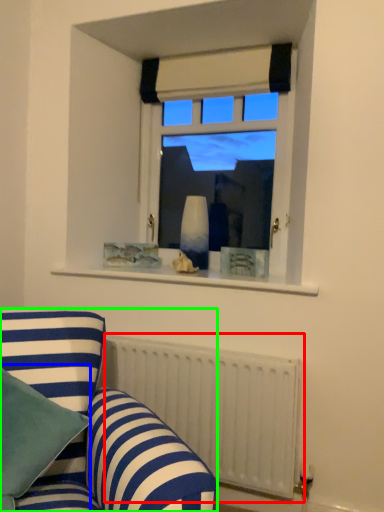
Question: Considering the real-world distances, which object is farthest from radiator (highlighted by a red box)? pillow (highlighted by a blue box) or studio couch (highlighted by a green box)?

Choices:
 (A) pillow
 (B) studio couch

Answer: (A)